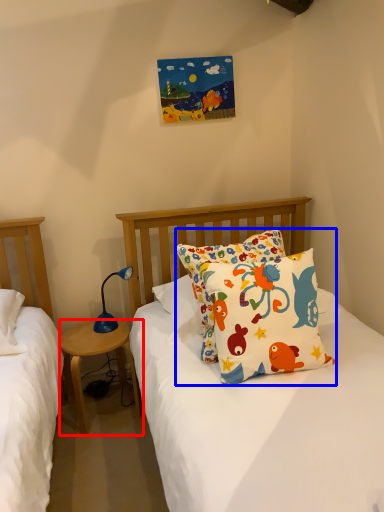
Question: Which point is closer to the camera, nightstand (highlighted by a red box) or pillow (highlighted by a blue box)?

Choices:
 (A) nightstand
 (B) pillow

Answer: (B)